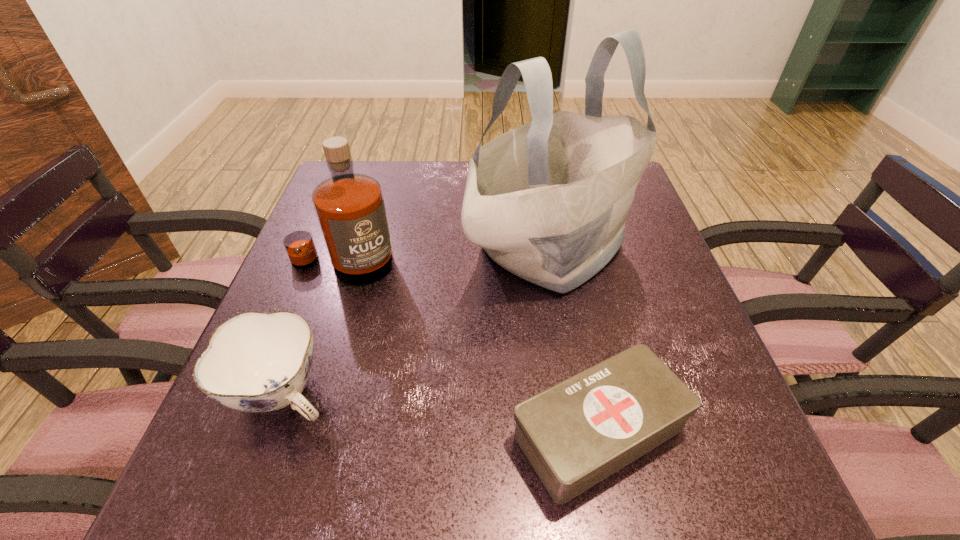
You are a GUI agent. You are given a task and a screenshot of the screen. Output one action in this format:
    pyautogui.click(x=<x>, y=<y>)
    Task: Click on the free space that is in between the liquor and the tallest object
    The width and height of the screenshot is (960, 540).
    Given the screenshot: What is the action you would take?
    pyautogui.click(x=446, y=255)

The width and height of the screenshot is (960, 540). Identify the location of free space between the second shortest object and the first-aid kit. (442, 413).

Where is `empty space between the tallest object and the first-aid kit`? empty space between the tallest object and the first-aid kit is located at coordinates (575, 339).

Find the location of `free space between the shopping bag and the first-aid kit`. free space between the shopping bag and the first-aid kit is located at coordinates (575, 339).

Where is `unoccupied position between the first-aid kit and the shopping bag`? The image size is (960, 540). unoccupied position between the first-aid kit and the shopping bag is located at coordinates (575, 339).

Image resolution: width=960 pixels, height=540 pixels. Identify the location of empty space between the third shortest object and the shopping bag. (446, 255).

I want to click on free space between the shortest object and the liquor, so click(470, 348).

In order to click on free space between the chinaware and the first-aid kit in this screenshot , I will do `click(442, 413)`.

Image resolution: width=960 pixels, height=540 pixels. In order to click on free space between the shortest object and the tallest object in this screenshot , I will do `click(575, 339)`.

The image size is (960, 540). What are the coordinates of `empty space between the liquor and the first-aid kit` in the screenshot? It's located at (470, 348).